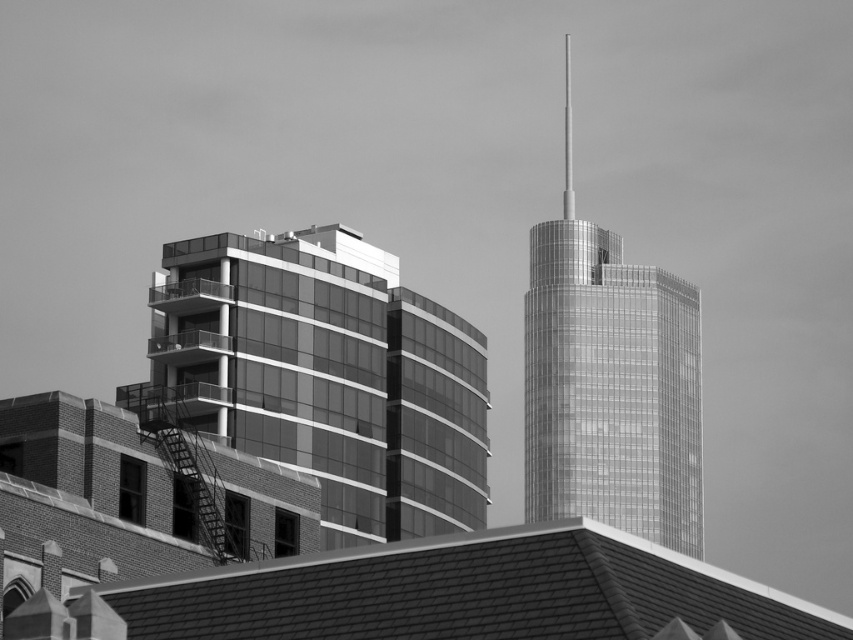
Question: Does glassy reflective building at center-left appear under glassy metallic skyscraper at center?

Choices:
 (A) no
 (B) yes

Answer: (B)

Question: Is glassy reflective building at center-left smaller than glassy metallic skyscraper at center?

Choices:
 (A) yes
 (B) no

Answer: (A)

Question: Is glassy reflective building at center-left behind glassy metallic skyscraper at center?

Choices:
 (A) no
 (B) yes

Answer: (A)

Question: Which of the following is the farthest from the observer?

Choices:
 (A) glassy reflective building at center-left
 (B) glassy metallic skyscraper at center

Answer: (B)

Question: Which of the following is the closest to the observer?

Choices:
 (A) glassy metallic skyscraper at center
 (B) glassy reflective building at center-left

Answer: (B)

Question: Which point appears farthest from the camera in this image?

Choices:
 (A) (651, 538)
 (B) (229, 268)

Answer: (A)